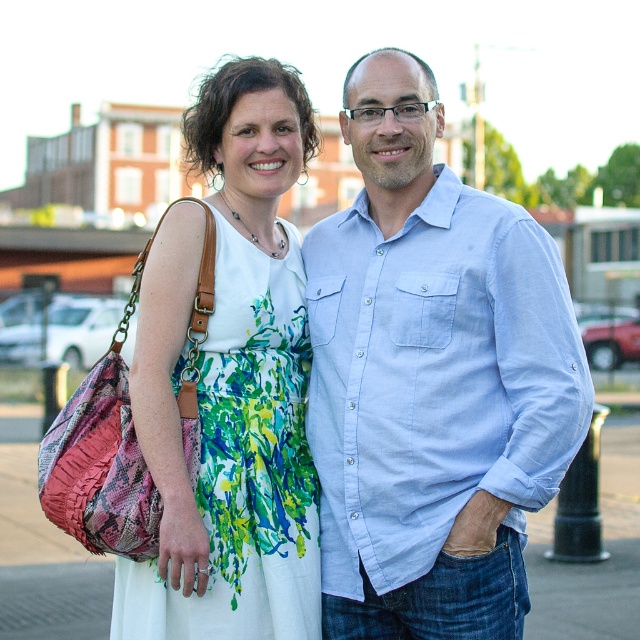
Question: Which point is farther to the camera?

Choices:
 (A) (x=413, y=605)
 (B) (x=275, y=428)

Answer: (B)

Question: Can you confirm if light blue denim shirt at center is positioned above floral print fabric dress at center?

Choices:
 (A) yes
 (B) no

Answer: (A)

Question: Is light blue denim shirt at center above floral print fabric dress at center?

Choices:
 (A) no
 (B) yes

Answer: (B)

Question: Can you confirm if light blue denim shirt at center is positioned to the left of floral print fabric dress at center?

Choices:
 (A) yes
 (B) no

Answer: (B)

Question: Which point is closer to the camera taking this photo?

Choices:
 (A) (444, 500)
 (B) (253, 257)

Answer: (A)